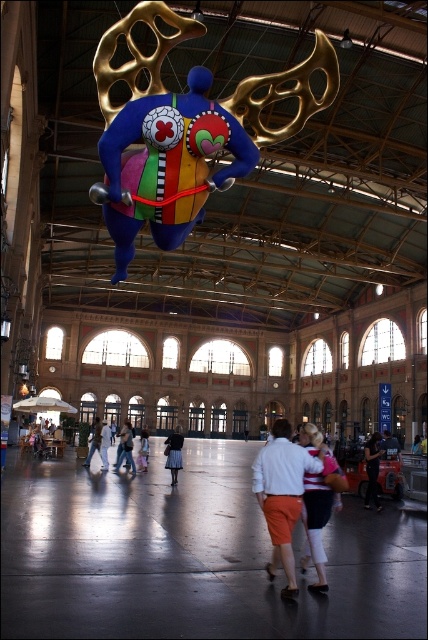
You are standing in the train station and see both the denim skirt at center and the white cotton dress at center. Which one is positioned more to the right side?

The denim skirt at center is positioned more to the right side than the white cotton dress at center.

You are a photographer standing in the train station and see both the white cotton shirt at center and the white cotton dress at center. You want to capture a photo that includes both items in the frame. Considering the distance between them, is it possible to fit both into a single photo without moving your position?

The distance between the white cotton shirt at center and the white cotton dress at center is 37.43 meters. At such a great distance, it would be challenging to capture both items in a single photo without moving your position, as most standard camera lenses cannot encompass such a wide field of view while keeping both subjects in focus and recognizable.